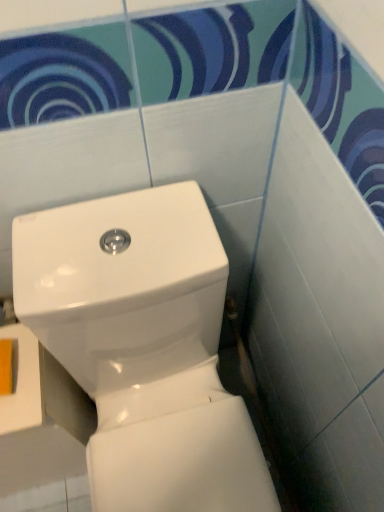
The image size is (384, 512). I want to click on vacant space situated above white glossy toilet at center (from a real-world perspective), so click(120, 251).